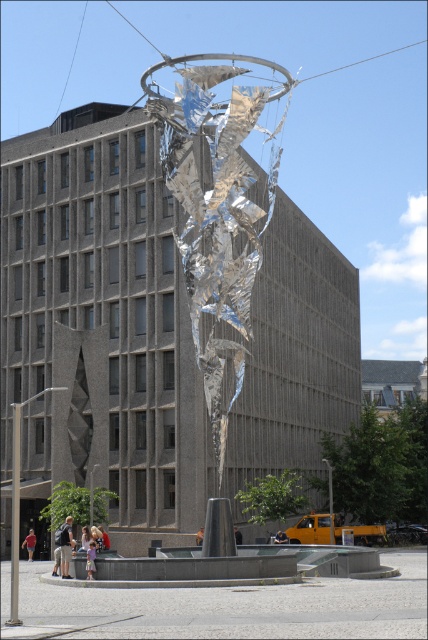
Does light brown leather jacket at lower left come behind light brown leather jacket at center?

No, it is in front of light brown leather jacket at center.

Can you confirm if light brown leather jacket at lower left is taller than light brown leather jacket at center?

Indeed, light brown leather jacket at lower left has a greater height compared to light brown leather jacket at center.

What do you see at coordinates (65, 545) in the screenshot?
I see `light brown leather jacket at lower left` at bounding box center [65, 545].

At what (x,y) coordinates should I click in order to perform the action: click on light brown leather jacket at lower left. Please return your answer as a coordinate pair (x, y). This screenshot has width=428, height=640. Looking at the image, I should click on (65, 545).

What do you see at coordinates (91, 560) in the screenshot? I see `light purple cotton dress at lower center` at bounding box center [91, 560].

This screenshot has width=428, height=640. What do you see at coordinates (91, 560) in the screenshot?
I see `light purple cotton dress at lower center` at bounding box center [91, 560].

I want to click on light purple cotton dress at lower center, so click(x=91, y=560).

Is shiny metallic sculpture at center in front of light brown leather jacket at center?

Yes, shiny metallic sculpture at center is in front of light brown leather jacket at center.

Is point (214, 81) less distant than point (279, 541)?

Yes.

Which is in front, point (214, 138) or point (273, 541)?

Point (214, 138)

Identify the location of shiny metallic sculpture at center. This screenshot has height=640, width=428. (216, 216).